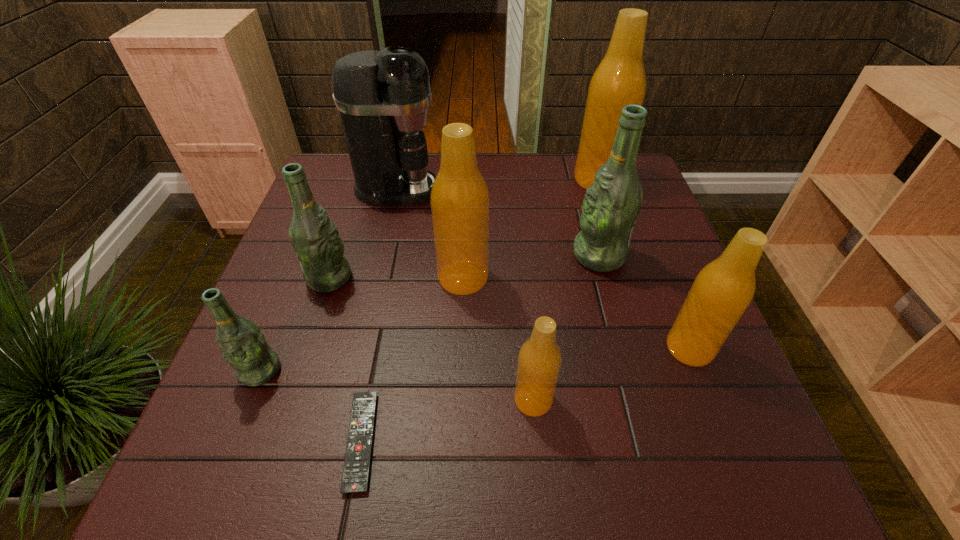
You are a GUI agent. You are given a task and a screenshot of the screen. Output one action in this format:
    pyautogui.click(x=<x>, y=<y>)
    Task: Click on the biggest tan beer bottle
    
    Given the screenshot: What is the action you would take?
    pyautogui.click(x=619, y=80)

You are a GUI agent. You are given a task and a screenshot of the screen. Output one action in this format:
    pyautogui.click(x=<x>, y=<y>)
    Task: Click on the tallest beer bottle
    The image size is (960, 540).
    Given the screenshot: What is the action you would take?
    pyautogui.click(x=619, y=80)

In order to click on coffee maker in this screenshot , I will do `click(383, 96)`.

I want to click on the rightmost green beer bottle, so click(612, 203).

The height and width of the screenshot is (540, 960). I want to click on the second biggest tan beer bottle, so 459,199.

You are a GUI agent. You are given a task and a screenshot of the screen. Output one action in this format:
    pyautogui.click(x=<x>, y=<y>)
    Task: Click on the third beer bottle from left to right
    Image resolution: width=960 pixels, height=540 pixels.
    Given the screenshot: What is the action you would take?
    pyautogui.click(x=459, y=199)

The width and height of the screenshot is (960, 540). I want to click on the second smallest green beer bottle, so tap(315, 239).

At what (x,y) coordinates should I click in order to perform the action: click on the second nearest tan beer bottle. Please return your answer as a coordinate pair (x, y). Image resolution: width=960 pixels, height=540 pixels. Looking at the image, I should click on (721, 292).

At what (x,y) coordinates should I click in order to perform the action: click on the smallest tan beer bottle. Please return your answer as a coordinate pair (x, y). This screenshot has height=540, width=960. Looking at the image, I should click on (539, 360).

Identify the location of the nearest tan beer bottle. Image resolution: width=960 pixels, height=540 pixels. (539, 360).